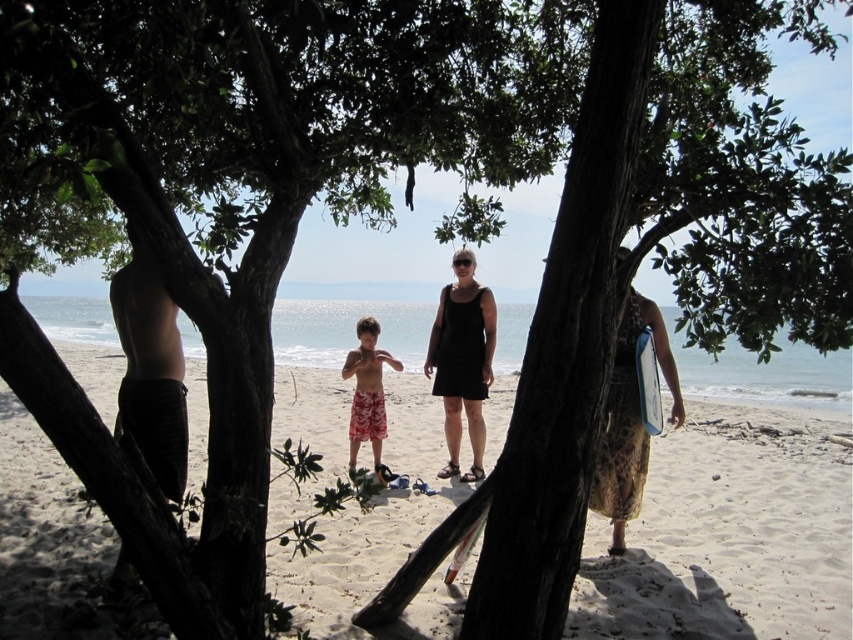
Question: Which object appears closest to the camera in this image?

Choices:
 (A) white matte surfboard at center
 (B) black matte shorts at left
 (C) beige sand at center
 (D) printed fabric dress at right

Answer: (B)

Question: Does printed fabric dress at right have a lesser width compared to black fabric dress at center?

Choices:
 (A) no
 (B) yes

Answer: (A)

Question: Which object is positioned farthest from the black matte shorts at left?

Choices:
 (A) printed fabric dress at right
 (B) white matte surfboard at center
 (C) black fabric dress at center

Answer: (C)

Question: Does black fabric dress at center have a larger size compared to white matte surfboard at center?

Choices:
 (A) yes
 (B) no

Answer: (A)

Question: Which point is farther to the camera?

Choices:
 (A) printed cotton shorts at center
 (B) black matte shorts at left

Answer: (A)

Question: Is beige sand at center thinner than printed fabric dress at right?

Choices:
 (A) no
 (B) yes

Answer: (A)